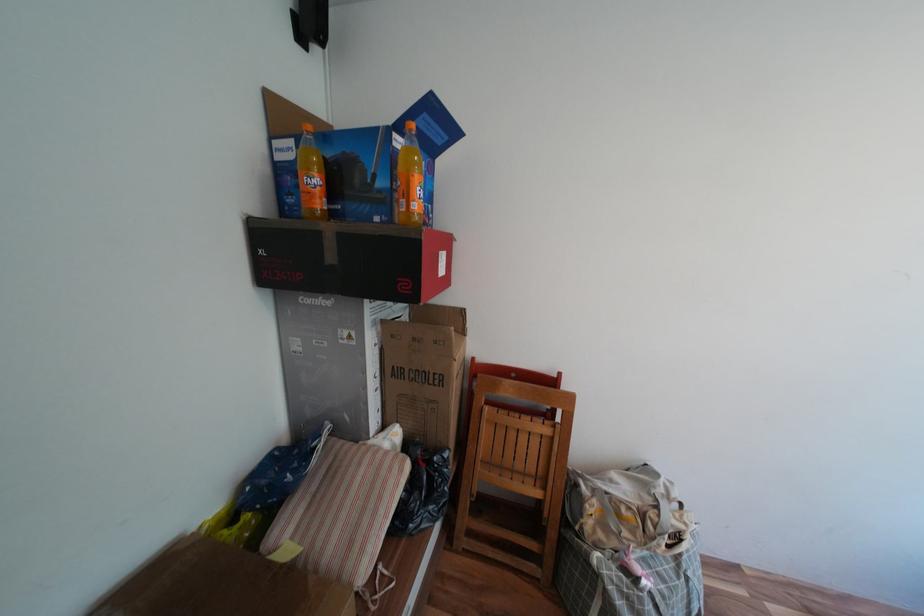
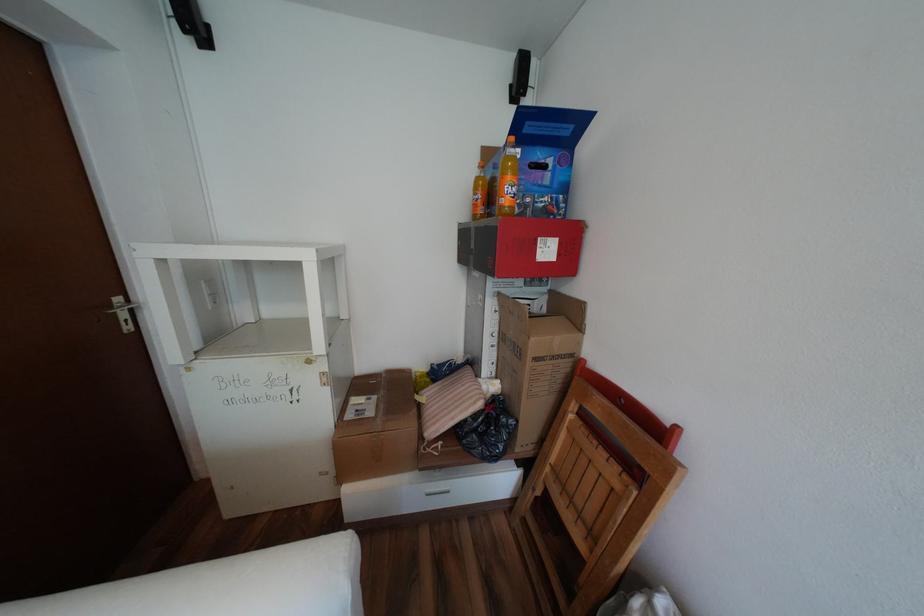
Question: The camera is either moving clockwise (left) or counter-clockwise (right) around the object. The first image is from the beginning of the video and the second image is from the end. Is the camera moving left or right when shooting the video?

Choices:
 (A) Left
 (B) Right

Answer: (B)